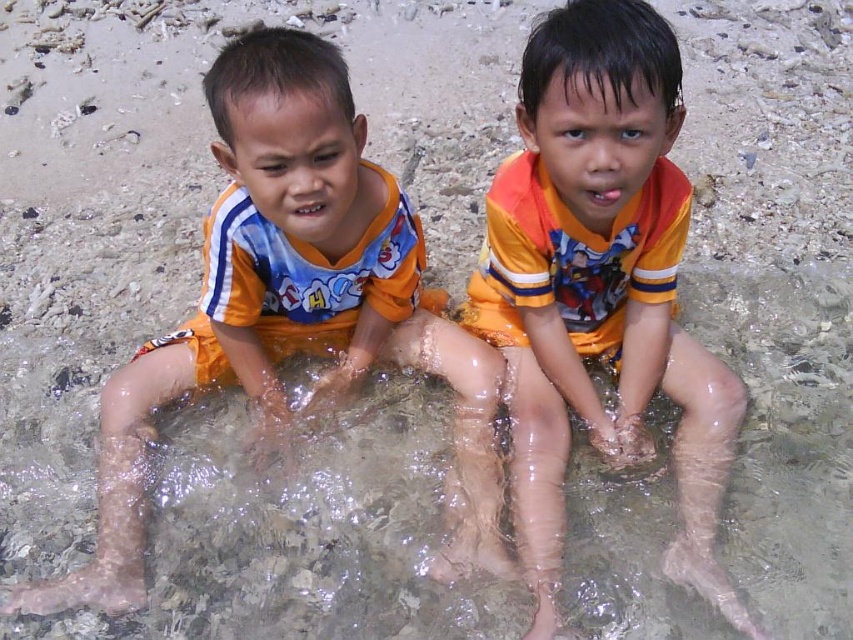
Which is more to the left, clear water at legs center or orange cotton shirt at center?

Positioned to the left is clear water at legs center.

What do you see at coordinates (300, 532) in the screenshot? I see `clear water at legs center` at bounding box center [300, 532].

Describe the element at coordinates (300, 532) in the screenshot. I see `clear water at legs center` at that location.

Find the location of a particular element. Image resolution: width=853 pixels, height=640 pixels. clear water at legs center is located at coordinates (300, 532).

How much distance is there between orange cotton shirt at center and orange fabric shirt at left?

orange cotton shirt at center is 34.22 centimeters away from orange fabric shirt at left.

Can you confirm if orange cotton shirt at center is positioned to the left of orange fabric shirt at left?

No, orange cotton shirt at center is not to the left of orange fabric shirt at left.

Find the location of a particular element. Image resolution: width=853 pixels, height=640 pixels. orange cotton shirt at center is located at coordinates 599,284.

Between clear water at legs center and orange fabric shirt at left, which one has less height?

Standing shorter between the two is clear water at legs center.

Is point (842, 534) positioned after point (239, 125)?

Yes, it is behind point (239, 125).

Find the location of a particular element. The width and height of the screenshot is (853, 640). clear water at legs center is located at coordinates (300, 532).